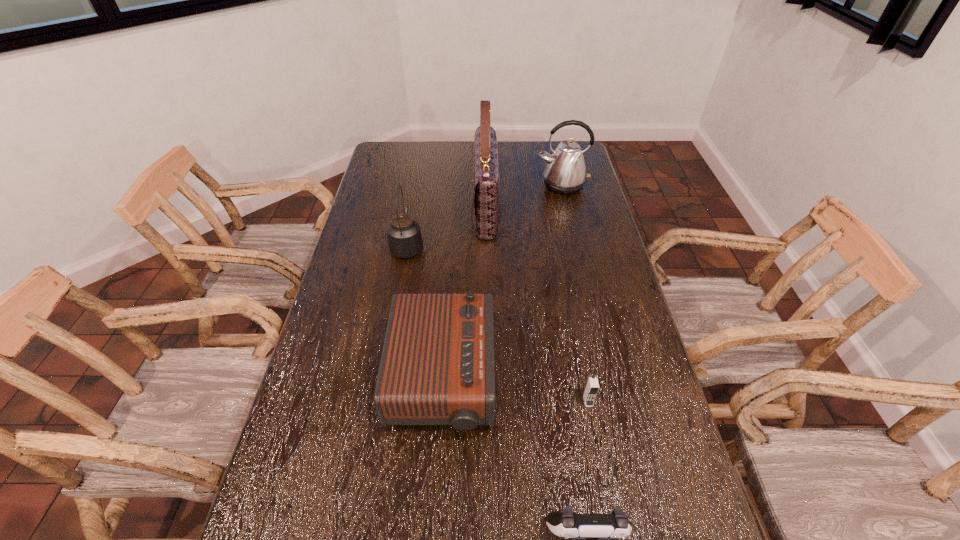
What are the coordinates of `blank region between the cellular telephone and the farther kettle` in the screenshot? It's located at (575, 293).

Identify the location of free space between the right kettle and the fifth tallest object. The height and width of the screenshot is (540, 960). (575, 293).

Where is `free space between the second shortest object and the fourth tallest object`? The width and height of the screenshot is (960, 540). free space between the second shortest object and the fourth tallest object is located at coordinates (515, 390).

You are a GUI agent. You are given a task and a screenshot of the screen. Output one action in this format:
    pyautogui.click(x=<x>, y=<y>)
    Task: Click on the empty space that is in between the cellular telephone and the nearer kettle
    The image size is (960, 540).
    Given the screenshot: What is the action you would take?
    pyautogui.click(x=497, y=323)

Find the location of a particular element. free space between the right kettle and the fifth tallest object is located at coordinates (575, 293).

Find the location of a particular element. The height and width of the screenshot is (540, 960). object that ranks as the second closest to the farther kettle is located at coordinates (405, 240).

Select which object is the second closest to the left kettle. Please provide its 2D coordinates. Your answer should be formatted as a tuple, i.e. [(x, y)], where the tuple contains the x and y coordinates of a point satisfying the conditions above.

[(437, 367)]